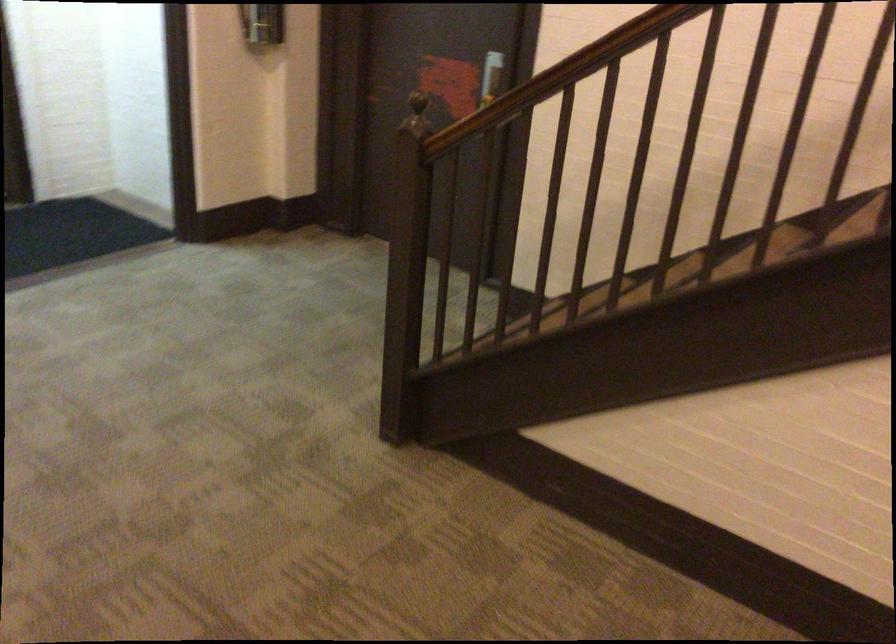
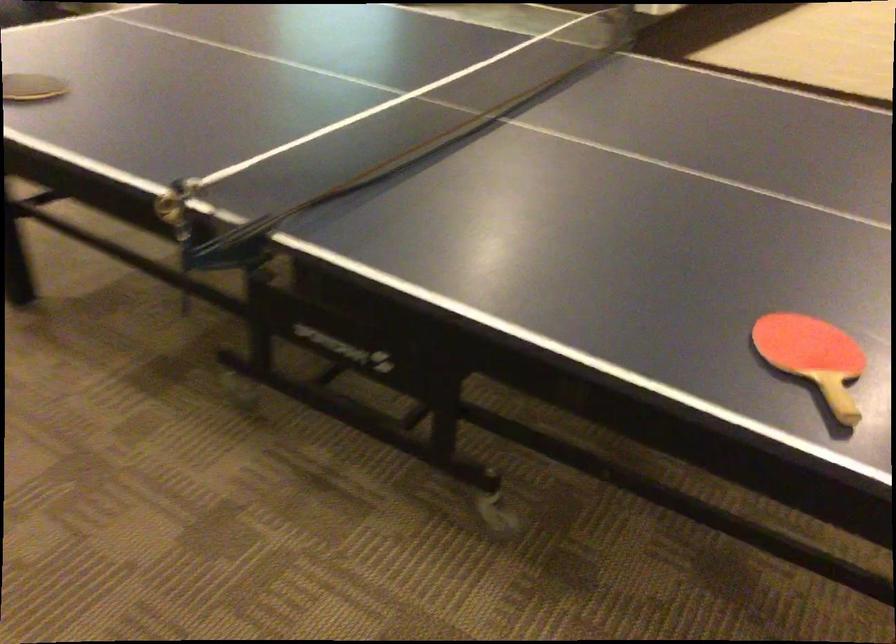
In a continuous first-person perspective shot, in which direction is the camera moving?

The cameraman walked toward left, backward.